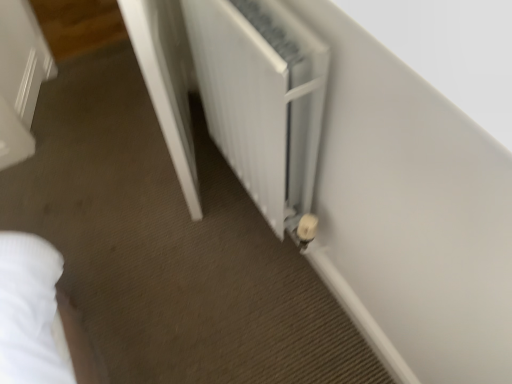
Question: Is point (288, 74) closer or farther from the camera than point (193, 157)?

Choices:
 (A) farther
 (B) closer

Answer: (B)

Question: Would you say white matte radiator at center is inside or outside white glossy door at center?

Choices:
 (A) outside
 (B) inside

Answer: (A)

Question: Based on their sizes in the image, would you say white matte radiator at center is bigger or smaller than white glossy door at center?

Choices:
 (A) big
 (B) small

Answer: (B)

Question: Is white glossy door at center in front of or behind white matte radiator at center in the image?

Choices:
 (A) behind
 (B) front

Answer: (A)

Question: From the image's perspective, is white glossy door at center positioned above or below white matte radiator at center?

Choices:
 (A) above
 (B) below

Answer: (A)

Question: Based on their positions, is white glossy door at center located to the left or right of white matte radiator at center?

Choices:
 (A) left
 (B) right

Answer: (A)

Question: From a real-world perspective, is white glossy door at center positioned above or below white matte radiator at center?

Choices:
 (A) above
 (B) below

Answer: (B)